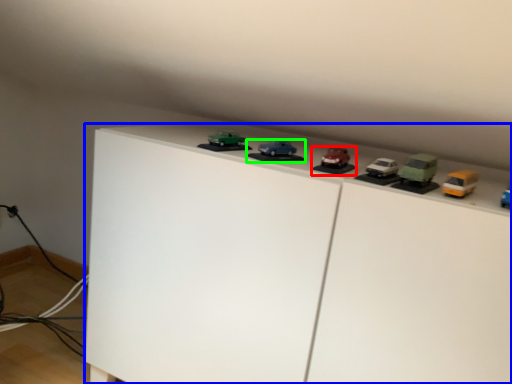
Question: Considering the real-world distances, which object is closest to toy (highlighted by a red box)? furniture (highlighted by a blue box) or toy (highlighted by a green box).

Choices:
 (A) furniture
 (B) toy

Answer: (B)